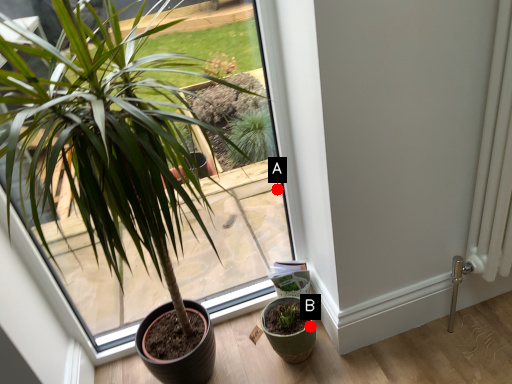
Question: Two points are circled on the image, labeled by A and B beside each circle. Which of the following is the closest to the observer?

Choices:
 (A) A is closer
 (B) B is closer

Answer: (B)